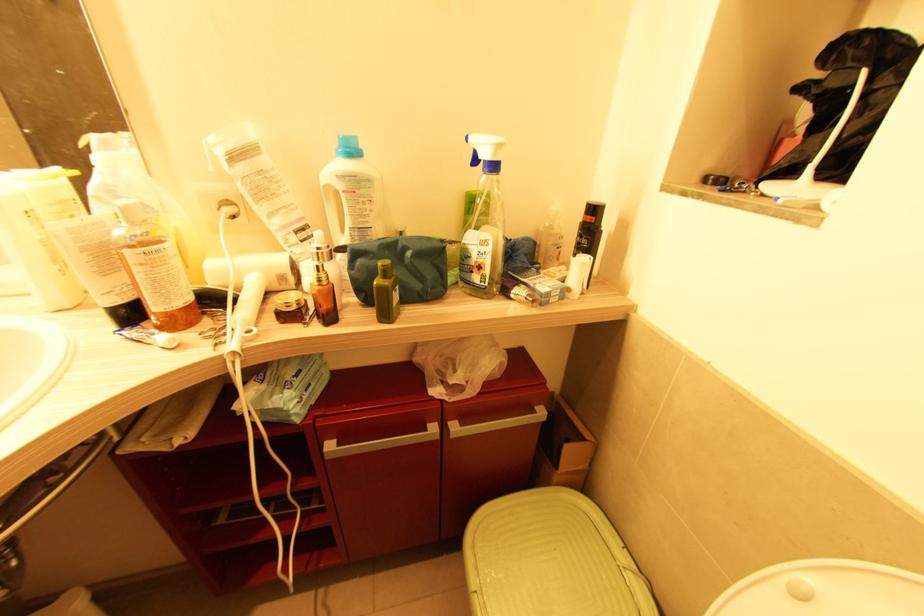
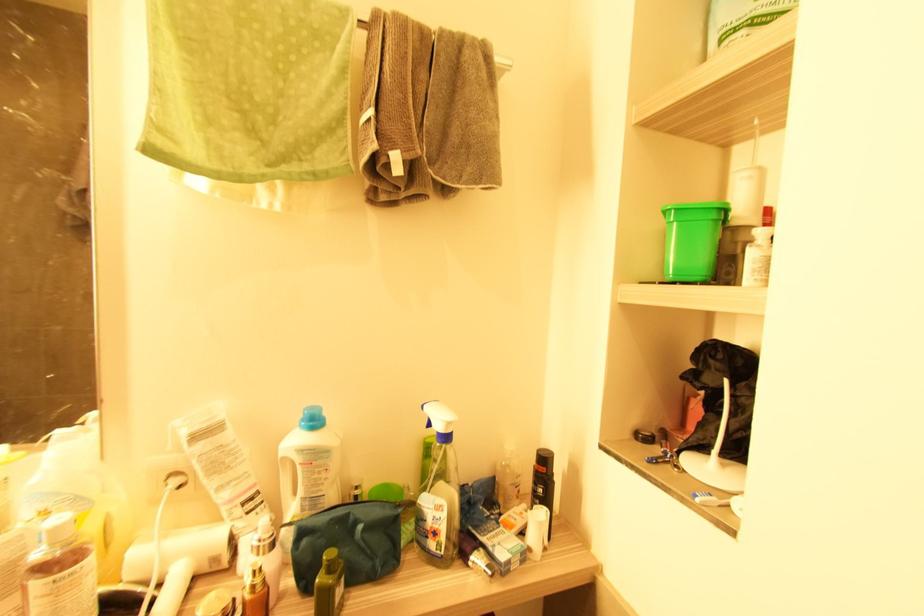
Where in the second image is the point corresponding to point (409, 254) from the first image?

(361, 529)